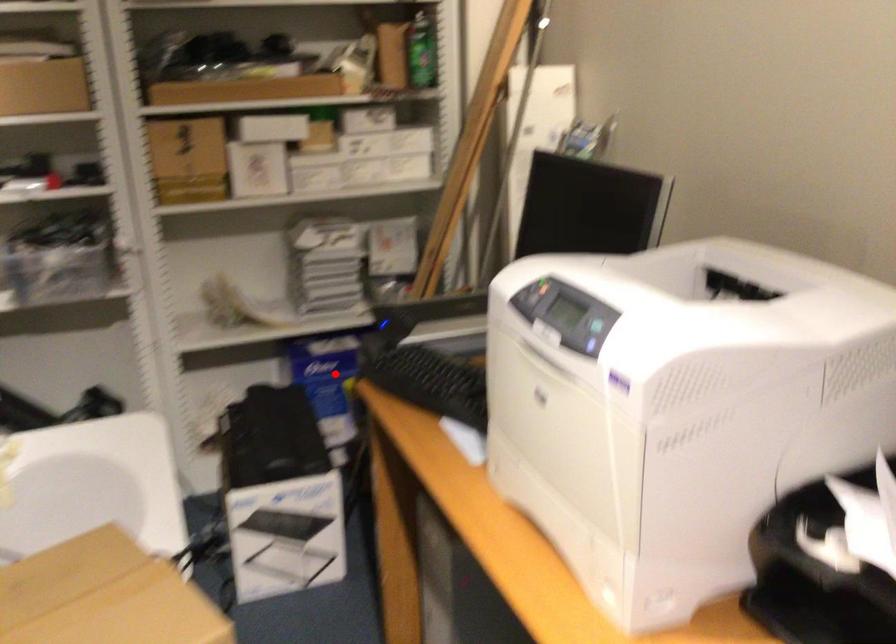
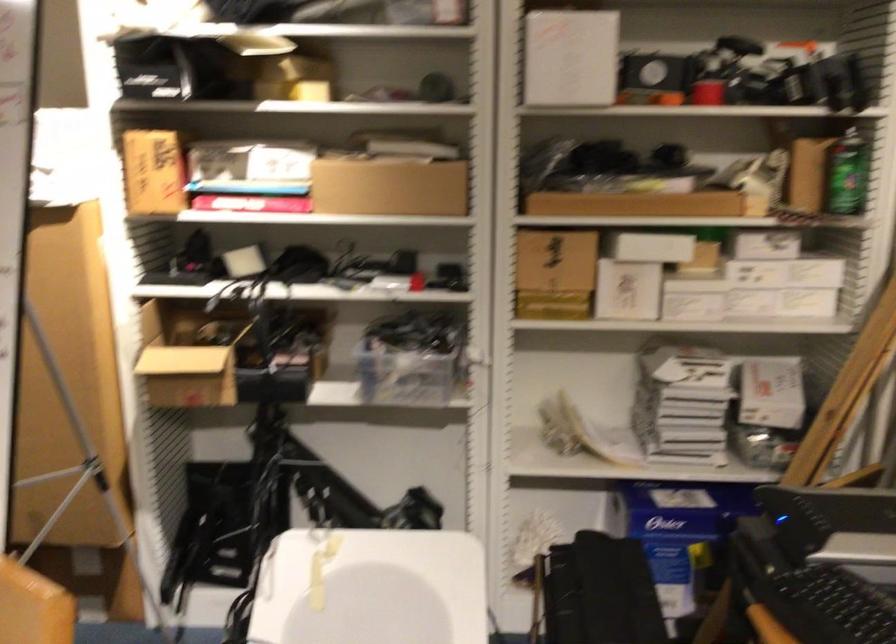
Where in the second image is the point corresponding to the highlighted location from the first image?

(683, 534)